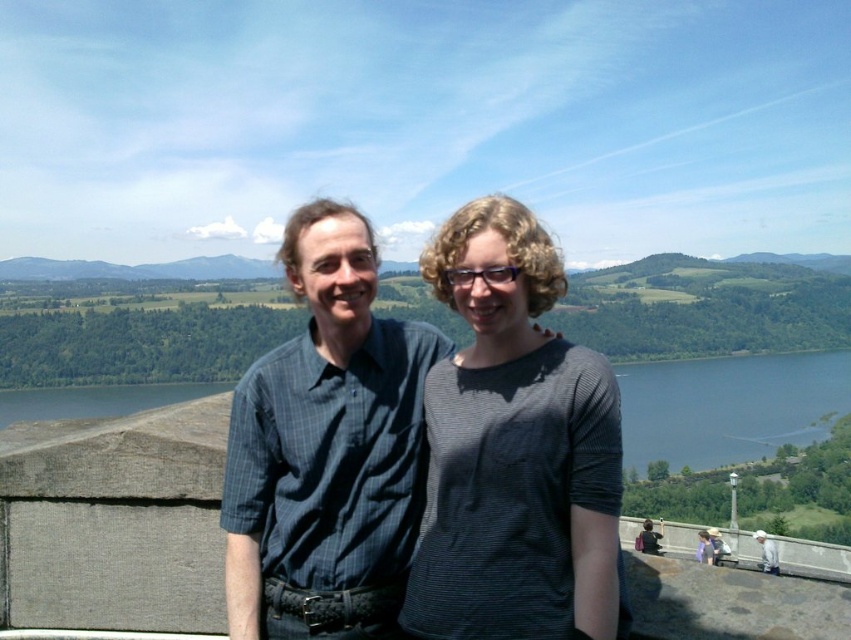
Can you confirm if blue water at lower right is shorter than blue water at lower left?

Correct, blue water at lower right is not as tall as blue water at lower left.

Which is more to the right, blue water at lower right or blue water at lower left?

From the viewer's perspective, blue water at lower right appears more on the right side.

Find the location of a particular element. The image size is (851, 640). blue water at lower right is located at coordinates (728, 406).

Between dark gray striped shirt at center and dark blue striped shirt at center, which one has more height?

Standing taller between the two is dark blue striped shirt at center.

Is dark gray striped shirt at center below dark blue striped shirt at center?

Indeed, dark gray striped shirt at center is positioned under dark blue striped shirt at center.

Between point (511, 538) and point (380, 564), which one is positioned behind?

The point (380, 564) is more distant.

You are a GUI agent. You are given a task and a screenshot of the screen. Output one action in this format:
    pyautogui.click(x=<x>, y=<y>)
    Task: Click on the dark gray striped shirt at center
    Image resolution: width=851 pixels, height=640 pixels.
    Given the screenshot: What is the action you would take?
    pyautogui.click(x=513, y=451)

Is dark gray striped shirt at center below blue water at lower right?

No, dark gray striped shirt at center is not below blue water at lower right.

Is point (610, 522) farther from camera compared to point (687, 433)?

No, it is in front of (687, 433).

I want to click on dark gray striped shirt at center, so click(x=513, y=451).